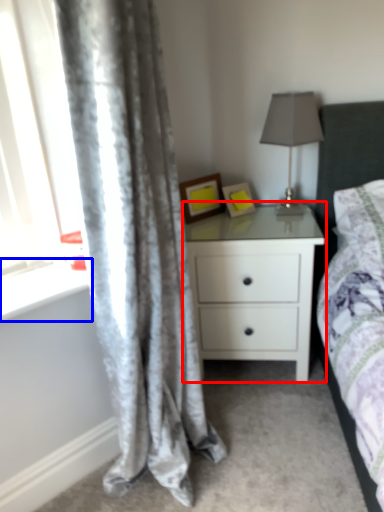
Question: Which point is closer to the camera, nightstand (highlighted by a red box) or window sill (highlighted by a blue box)?

Choices:
 (A) nightstand
 (B) window sill

Answer: (B)